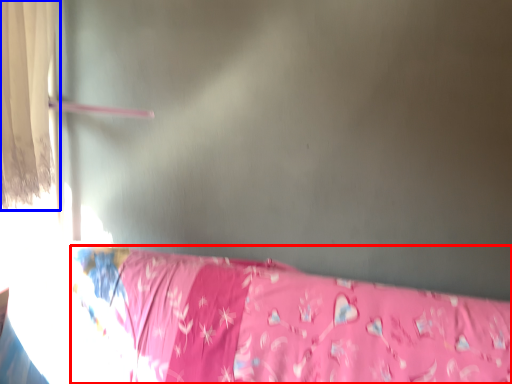
Question: Among these objects, which one is farthest to the camera, furniture (highlighted by a red box) or curtain (highlighted by a blue box)?

Choices:
 (A) furniture
 (B) curtain

Answer: (B)